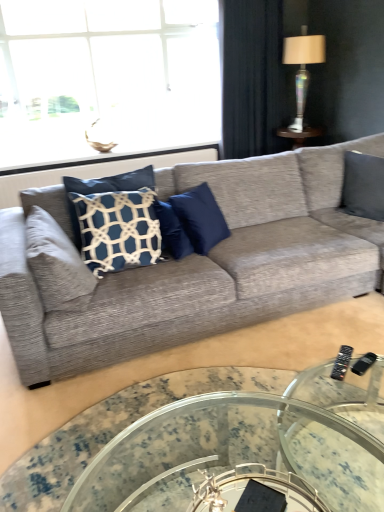
Describe the element at coordinates (200, 218) in the screenshot. I see `blue velvet pillow at center, which is the 2th pillow from left to right` at that location.

What do you see at coordinates (114, 430) in the screenshot? I see `transparent glass coffee table at lower center` at bounding box center [114, 430].

Measure the distance between point (73, 282) and camera.

The depth of point (73, 282) is 1.96 meters.

Consider the image. What is the approximate width of textured gray couch at center?

It is 3.96 feet.

This screenshot has width=384, height=512. I want to click on blue velvet pillow at center, positioned as the first pillow in right-to-left order, so click(200, 218).

Is transparent glass coffee table at lower center at the right side of blue velvet pillow at center, which is the 2th pillow from left to right?

Correct, you'll find transparent glass coffee table at lower center to the right of blue velvet pillow at center, which is the 2th pillow from left to right.

From the image's perspective, is transparent glass coffee table at lower center over blue velvet pillow at center, which is the 2th pillow from left to right?

Incorrect, from the image's perspective, transparent glass coffee table at lower center is lower than blue velvet pillow at center, which is the 2th pillow from left to right.

Between transparent glass coffee table at lower center and blue velvet pillow at center, positioned as the first pillow in right-to-left order, which one has less height?

With less height is transparent glass coffee table at lower center.

Considering the relative positions of transparent glass coffee table at lower center and blue velvet pillow at center, which is the 2th pillow from left to right, in the image provided, is transparent glass coffee table at lower center in front of blue velvet pillow at center, which is the 2th pillow from left to right,?

Yes, the depth of transparent glass coffee table at lower center is less than that of blue velvet pillow at center, which is the 2th pillow from left to right.

Is clear glass window at upper left inside the boundaries of textured gray couch at center, or outside?

clear glass window at upper left is not inside textured gray couch at center, it's outside.

From a real-world perspective, is clear glass window at upper left located higher than textured gray couch at center?

Yes.

Is clear glass window at upper left oriented away from textured gray couch at center?

No, clear glass window at upper left is not facing away from textured gray couch at center.

How much distance is there between clear glass window at upper left and textured gray couch at center?

They are 2.19 meters apart.

From their relative heights in the image, would you say transparent glass coffee table at lower center is taller or shorter than textured gray couch at center?

transparent glass coffee table at lower center is shorter than textured gray couch at center.

Is point (51, 482) positioned after point (320, 255)?

That is False.

From the image's perspective, is transparent glass coffee table at lower center under textured gray couch at center?

Indeed, from the image's perspective, transparent glass coffee table at lower center is shown beneath textured gray couch at center.

Does transparent glass coffee table at lower center have a smaller size compared to textured gray couch at center?

Yes.

Measure the distance between translucent glass lampshade at upper right and transparent glass coffee table at lower center.

They are 3.35 meters apart.

Could you tell me if translucent glass lampshade at upper right is facing transparent glass coffee table at lower center?

No, translucent glass lampshade at upper right is not turned towards transparent glass coffee table at lower center.

Is translucent glass lampshade at upper right with transparent glass coffee table at lower center?

No.

Between point (317, 37) and point (42, 449), which one is positioned behind?

The point (317, 37) is behind.

Are black plastic remote at lower right and dark blue fabric curtain at upper right making contact?

black plastic remote at lower right and dark blue fabric curtain at upper right are not in contact.

How different are the orientations of black plastic remote at lower right and dark blue fabric curtain at upper right in degrees?

black plastic remote at lower right and dark blue fabric curtain at upper right are facing 48.6 degrees away from each other.

Considering the sizes of black plastic remote at lower right and dark blue fabric curtain at upper right in the image, is black plastic remote at lower right bigger or smaller than dark blue fabric curtain at upper right?

Clearly, black plastic remote at lower right is smaller in size than dark blue fabric curtain at upper right.

Is point (342, 362) more distant than point (233, 117)?

No, (342, 362) is closer to viewer.

Is translucent glass lampshade at upper right located outside textured gray couch at center?

Absolutely, translucent glass lampshade at upper right is external to textured gray couch at center.

Does translucent glass lampshade at upper right have a lesser width compared to textured gray couch at center?

Indeed, translucent glass lampshade at upper right has a lesser width compared to textured gray couch at center.

You are a GUI agent. You are given a task and a screenshot of the screen. Output one action in this format:
    pyautogui.click(x=<x>, y=<y>)
    Task: Click on the lamp behind the textured gray couch at center
    The width and height of the screenshot is (384, 512).
    Given the screenshot: What is the action you would take?
    pyautogui.click(x=302, y=68)

Which of these two, translucent glass lampshade at upper right or textured gray couch at center, stands shorter?

With less height is textured gray couch at center.

Considering their positions, is blue velvet pillow at center, positioned as the first pillow in right-to-left order, located in front of or behind black plastic remote at lower right?

blue velvet pillow at center, positioned as the first pillow in right-to-left order, is behind black plastic remote at lower right.

What's the angular difference between blue velvet pillow at center, positioned as the first pillow in right-to-left order, and black plastic remote at lower right's facing directions?

There is a 87.3-degree angle between the facing directions of blue velvet pillow at center, positioned as the first pillow in right-to-left order, and black plastic remote at lower right.

Is black plastic remote at lower right at the back of blue velvet pillow at center, which is the 2th pillow from left to right?

No, blue velvet pillow at center, which is the 2th pillow from left to right, is not facing away from black plastic remote at lower right.

Is blue velvet pillow at center, which is the 2th pillow from left to right, wider than black plastic remote at lower right?

Yes.

At what (x,y) coordinates should I click in order to perform the action: click on coffee table in front of the blue velvet pillow at center, positioned as the first pillow in right-to-left order. Please return your answer as a coordinate pair (x, y). This screenshot has height=512, width=384. Looking at the image, I should click on point(114,430).

Identify the location of window located above the textured gray couch at center (from the image's perspective). Image resolution: width=384 pixels, height=512 pixels. (106, 77).

Estimate the real-world distances between objects in this image. Which object is closer to dark blue fabric curtain at upper right, blue velvet pillow at center, which is the 2th pillow from left to right, or textured gray couch at center?

textured gray couch at center is closer to dark blue fabric curtain at upper right.

Which object lies nearer to the anchor point dark blue fabric curtain at upper right, textured gray couch at center or clear glass window at upper left?

clear glass window at upper left lies closer to dark blue fabric curtain at upper right than the other object.

Which object lies further to the anchor point transparent glass coffee table at lower center, dark blue fabric curtain at upper right or translucent glass lampshade at upper right?

dark blue fabric curtain at upper right lies further to transparent glass coffee table at lower center than the other object.

Looking at the image, which one is located further to black plastic remote at lower right, dark blue fabric curtain at upper right or translucent glass lampshade at upper right?

dark blue fabric curtain at upper right lies further to black plastic remote at lower right than the other object.

Estimate the real-world distances between objects in this image. Which object is further from blue velvet pillow at center, which is the 2th pillow from left to right, black plastic remote at lower right or textured gray couch at center?

Among the two, black plastic remote at lower right is located further to blue velvet pillow at center, which is the 2th pillow from left to right.

Looking at the image, which one is located further to textured gray couch at center, transparent glass coffee table at lower center or black plastic remote at lower right?

black plastic remote at lower right.

Considering their positions, is textured gray couch at center positioned further to transparent glass coffee table at lower center than clear glass window at upper left?

clear glass window at upper left lies further to transparent glass coffee table at lower center than the other object.

Estimate the real-world distances between objects in this image. Which object is further from translucent glass lampshade at upper right, textured gray couch at center or transparent glass coffee table at lower center?

Among the two, transparent glass coffee table at lower center is located further to translucent glass lampshade at upper right.

Locate an element on the screen. This screenshot has height=512, width=384. curtain between black plastic remote at lower right and translucent glass lampshade at upper right from front to back is located at coordinates (252, 78).

The width and height of the screenshot is (384, 512). Find the location of `pillow positioned between transparent glass coffee table at lower center and blue velvet pillow at center, which is the 2th pillow from left to right, from near to far`. pillow positioned between transparent glass coffee table at lower center and blue velvet pillow at center, which is the 2th pillow from left to right, from near to far is located at coordinates (56, 265).

The image size is (384, 512). I want to click on remote positioned between transparent glass coffee table at lower center and dark blue fabric curtain at upper right from near to far, so click(x=342, y=362).

You are a GUI agent. You are given a task and a screenshot of the screen. Output one action in this format:
    pyautogui.click(x=<x>, y=<y>)
    Task: Click on the window between translucent glass lampshade at upper right and black plastic remote at lower right in the up-down direction
    
    Given the screenshot: What is the action you would take?
    pyautogui.click(x=106, y=77)